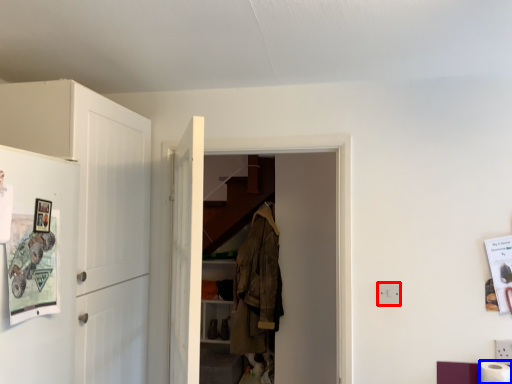
Question: Which object is closer to the camera taking this photo, electric outlet (highlighted by a red box) or toilet paper (highlighted by a blue box)?

Choices:
 (A) electric outlet
 (B) toilet paper

Answer: (B)